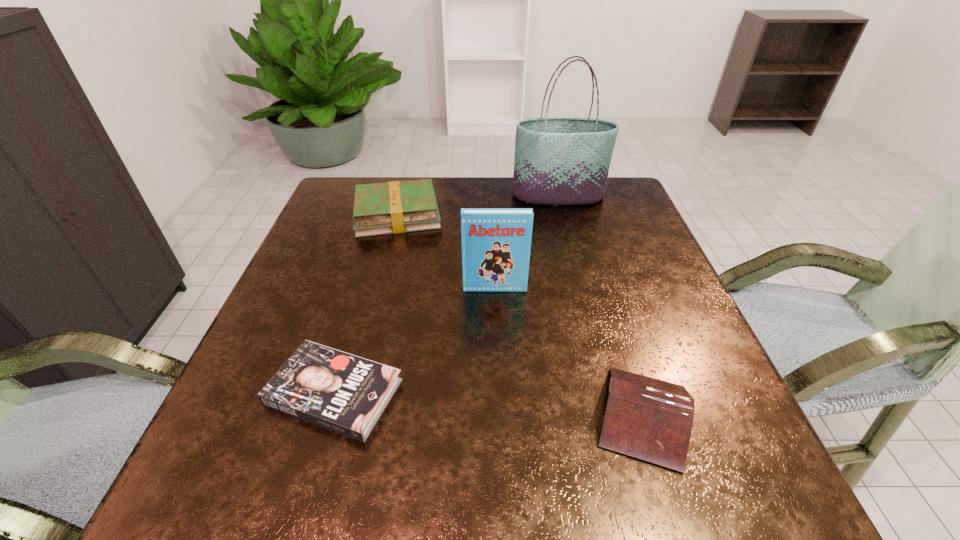
Locate an element on the screen. Image resolution: width=960 pixels, height=540 pixels. free space between the farthest book and the shortest object is located at coordinates (366, 303).

The image size is (960, 540). I want to click on vacant space that is in between the rightmost book and the third book from left to right, so click(569, 353).

Find the location of a particular element. This screenshot has height=540, width=960. object that stands as the fourth closest to the third nearest object is located at coordinates [558, 160].

Select which object is the fourth closest to the rightmost book. Please provide its 2D coordinates. Your answer should be formatted as a tuple, i.e. [(x, y)], where the tuple contains the x and y coordinates of a point satisfying the conditions above.

[(558, 160)]

At what (x,y) coordinates should I click in order to perform the action: click on book that is the third closest to the tallest object. Please return your answer as a coordinate pair (x, y). Image resolution: width=960 pixels, height=540 pixels. Looking at the image, I should click on (649, 419).

Where is `book identified as the second closest to the tote bag`? This screenshot has width=960, height=540. book identified as the second closest to the tote bag is located at coordinates (496, 242).

Where is `vacant space that satisfies the following two spatial constraints: 1. on the front cover of the rightmost book; 2. on the left side of the third book from left to right`? vacant space that satisfies the following two spatial constraints: 1. on the front cover of the rightmost book; 2. on the left side of the third book from left to right is located at coordinates (499, 416).

The width and height of the screenshot is (960, 540). What are the coordinates of `blank space that satisfies the following two spatial constraints: 1. on the front side of the rightmost book; 2. on the left side of the farthest book` in the screenshot? It's located at (346, 416).

Where is `blank space that satisfies the following two spatial constraints: 1. on the front side of the shortest book; 2. on the left side of the rightmost book`? This screenshot has height=540, width=960. blank space that satisfies the following two spatial constraints: 1. on the front side of the shortest book; 2. on the left side of the rightmost book is located at coordinates (327, 416).